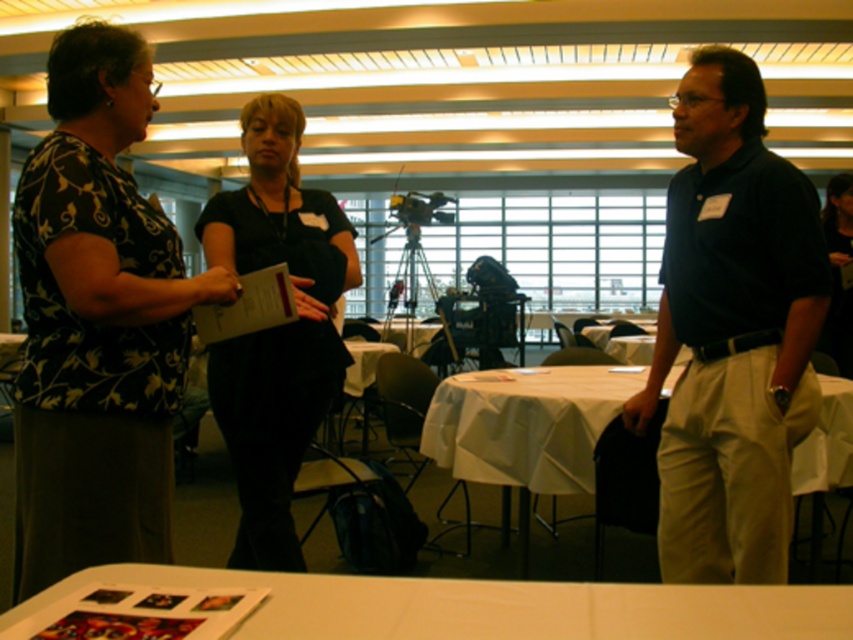
You are a photographer setting up for an event. You need to position a camera on the white matte table at lower center so that it can capture the black floral blouse at left clearly. Considering their heights, will the camera be able to see the entire blouse without obstruction?

The black floral blouse at left is much taller than the white matte table at lower center, so the camera placed on the table will have an unobstructed view of the entire blouse since the blouse is positioned higher.

Based on the photo, you are a photographer trying to capture a photo of the dark blue shirt at center and the white cloth table at center. Based on their positions, which object should you focus on first to ensure both are in frame?

The dark blue shirt at center is positioned on the right side of white cloth table at center, so you should focus on the white cloth table at center first to ensure both are in frame.